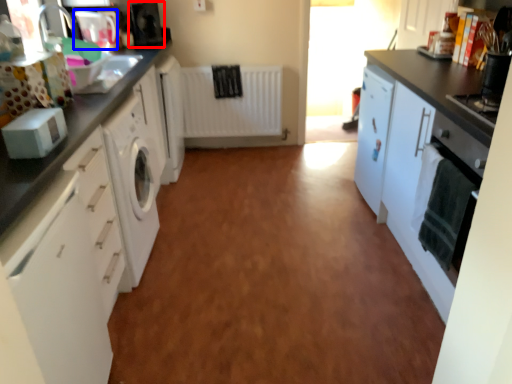
Question: Which point is closer to the camera, appliance (highlighted by a red box) or appliance (highlighted by a blue box)?

Choices:
 (A) appliance
 (B) appliance

Answer: (B)